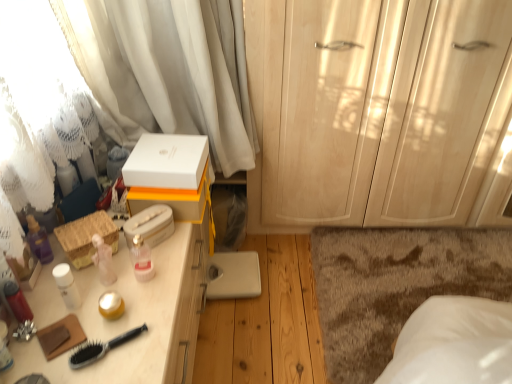
Find the location of a particular element. This screenshot has height=384, width=512. free location in front of white matte tissue box at upper center, arranged as the second storage box when ordered from the bottom is located at coordinates (136, 273).